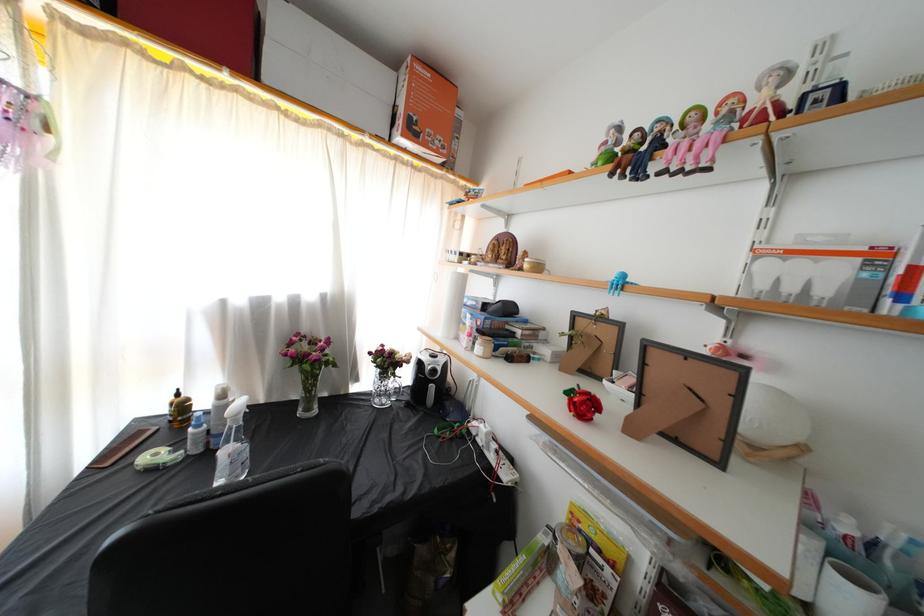
The image size is (924, 616). Describe the element at coordinates (308, 367) in the screenshot. I see `the red rose object` at that location.